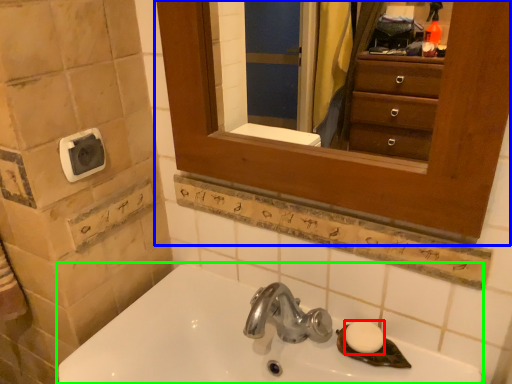
Question: Based on their relative distances, which object is farther from soap (highlighted by a red box)? Choose from medicine cabinet (highlighted by a blue box) and sink (highlighted by a green box).

Choices:
 (A) medicine cabinet
 (B) sink

Answer: (A)